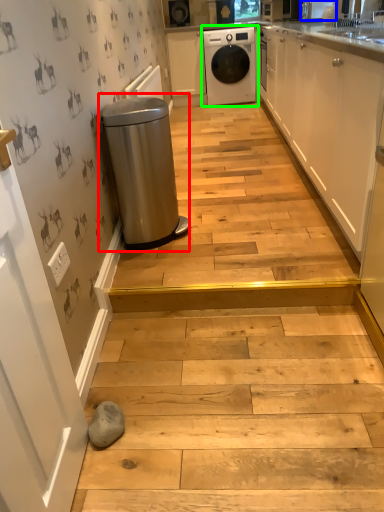
Question: Which object is positioned closest to waste container (highlighted by a red box)? Select from appliance (highlighted by a blue box) and home appliance (highlighted by a green box).

Choices:
 (A) appliance
 (B) home appliance

Answer: (A)